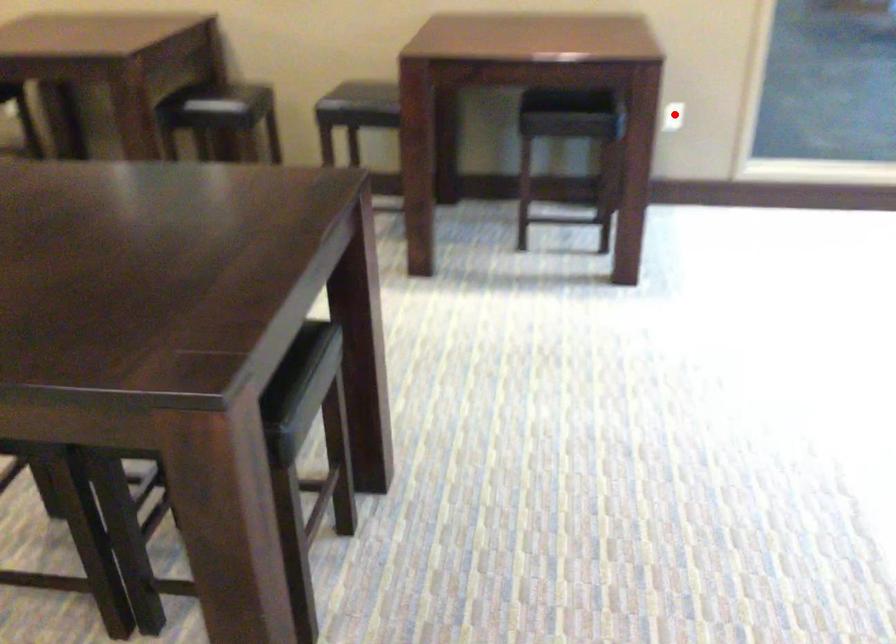
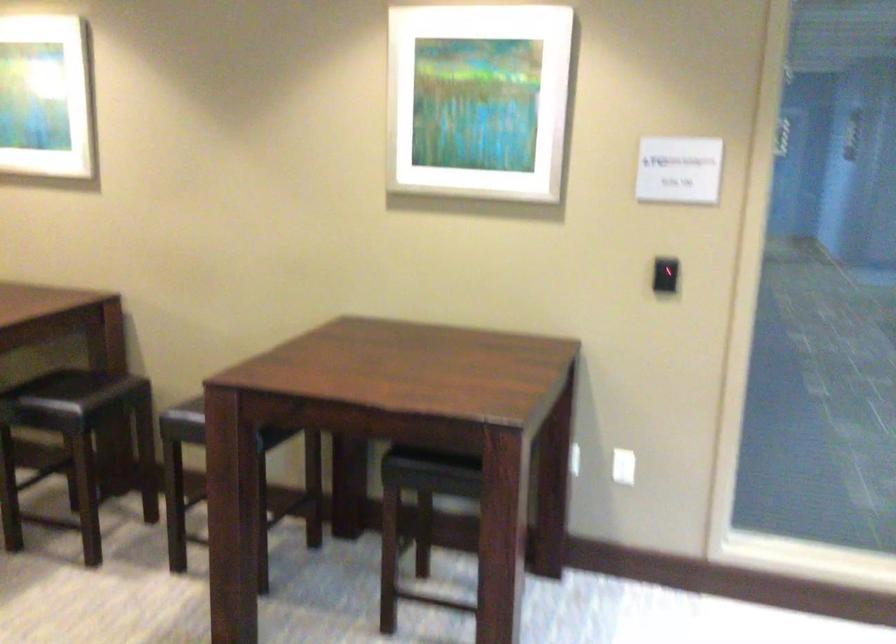
Question: I am providing you with two images of the same scene from different viewpoints. Given a red point in image1, look at the same physical point in image2. Is it:

Choices:
 (A) Closer to the viewpoint
 (B) Farther from the viewpoint

Answer: (A)